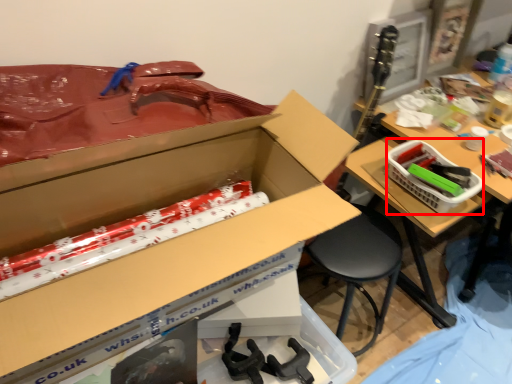
Question: Observing the image, what is the correct spatial positioning of basket (annotated by the red box) in reference to box?

Choices:
 (A) right
 (B) left

Answer: (A)